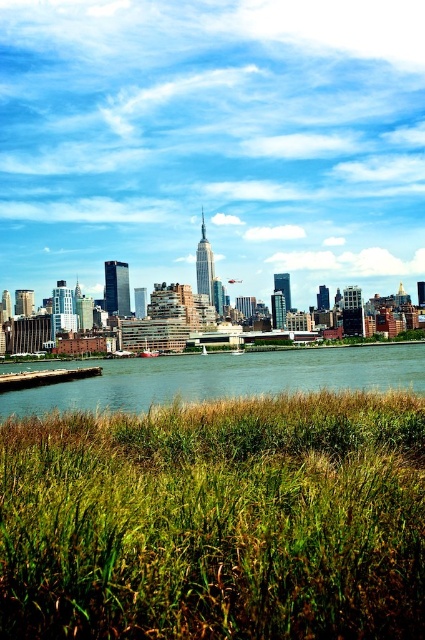
Question: Is green grassy field at lower center positioned in front of green grassy river at lower center?

Choices:
 (A) yes
 (B) no

Answer: (A)

Question: Does blue sky at upper center have a greater width compared to green grassy river at lower center?

Choices:
 (A) yes
 (B) no

Answer: (A)

Question: Estimate the real-world distances between objects in this image. Which object is closer to the green grassy field at lower center?

Choices:
 (A) green grassy river at lower center
 (B) blue sky at upper center

Answer: (A)

Question: Among these points, which one is nearest to the camera?

Choices:
 (A) (346, 129)
 (B) (167, 364)

Answer: (B)

Question: Which point is closer to the camera?

Choices:
 (A) blue sky at upper center
 (B) green grassy river at lower center

Answer: (B)

Question: Is blue sky at upper center to the right of green grassy field at lower center from the viewer's perspective?

Choices:
 (A) no
 (B) yes

Answer: (A)